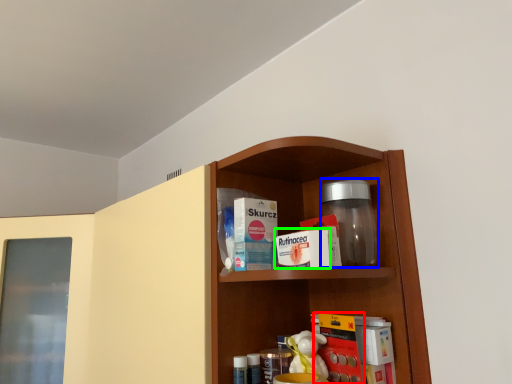
Question: Which object is the closest to the book (highlighted by a red box)? Choose among these: glass jar (highlighted by a blue box) or product (highlighted by a green box).

Choices:
 (A) glass jar
 (B) product

Answer: (A)